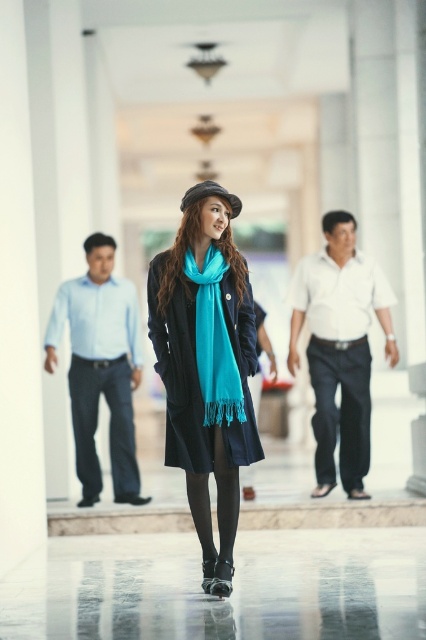
Which is more to the right, matte black coat at center or teal silk scarf at center?

teal silk scarf at center

Does matte black coat at center appear on the right side of teal silk scarf at center?

No, matte black coat at center is not to the right of teal silk scarf at center.

Where is `matte black coat at center`? This screenshot has height=640, width=426. matte black coat at center is located at coordinates (206, 371).

Which is above, teal soft scarf at center or dark blue jeans at center?

teal soft scarf at center is higher up.

Which is more to the left, teal soft scarf at center or dark blue jeans at center?

teal soft scarf at center is more to the left.

Between point (189, 444) and point (368, 348), which one is positioned behind?

The point (368, 348) is more distant.

You are a GUI agent. You are given a task and a screenshot of the screen. Output one action in this format:
    pyautogui.click(x=<x>, y=<y>)
    Task: Click on the teal soft scarf at center
    
    Given the screenshot: What is the action you would take?
    pyautogui.click(x=178, y=371)

Which is behind, point (152, 268) or point (189, 202)?

The point (152, 268) is behind.

Does teal soft scarf at center have a larger size compared to matte black hat at center?

Correct, teal soft scarf at center is larger in size than matte black hat at center.

Between point (247, 337) and point (207, 188), which one is positioned behind?

Point (247, 337)

In order to click on teal soft scarf at center in this screenshot , I will do `click(178, 371)`.